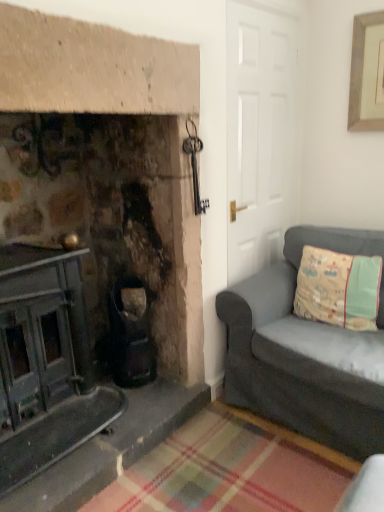
The width and height of the screenshot is (384, 512). Find the location of `dark gray fabric couch at right`. dark gray fabric couch at right is located at coordinates (305, 351).

Describe the element at coordinates (305, 351) in the screenshot. This screenshot has height=512, width=384. I see `dark gray fabric couch at right` at that location.

You are a GUI agent. You are given a task and a screenshot of the screen. Output one action in this format:
    pyautogui.click(x=<x>, y=<y>)
    Task: Click on the beige fabric pillow at right
    
    Given the screenshot: What is the action you would take?
    pyautogui.click(x=338, y=288)

Measure the distance between beige fabric pillow at right and camera.

The depth of beige fabric pillow at right is 2.03 meters.

The image size is (384, 512). Describe the element at coordinates (338, 288) in the screenshot. I see `beige fabric pillow at right` at that location.

Locate an element on the screen. dark gray fabric couch at right is located at coordinates (305, 351).

Is beige fabric pillow at right at the left side of dark gray fabric couch at right?

No, beige fabric pillow at right is not to the left of dark gray fabric couch at right.

From the picture: Does beige fabric pillow at right come in front of dark gray fabric couch at right?

No, it is behind dark gray fabric couch at right.

Considering the positions of points (327, 297) and (290, 232), is point (327, 297) farther from camera compared to point (290, 232)?

That is False.

From the image's perspective, does beige fabric pillow at right appear higher than dark gray fabric couch at right?

Yes, from the image's perspective, beige fabric pillow at right is on top of dark gray fabric couch at right.

From a real-world perspective, which object stands above the other?

beige fabric pillow at right is physically above.

Between beige fabric pillow at right and dark gray fabric couch at right, which one has larger width?

Wider between the two is dark gray fabric couch at right.

Based on the photo, can you confirm if beige fabric pillow at right is shorter than dark gray fabric couch at right?

Yes, beige fabric pillow at right is shorter than dark gray fabric couch at right.

Based on their sizes in the image, would you say beige fabric pillow at right is bigger or smaller than dark gray fabric couch at right?

In the image, beige fabric pillow at right appears to be smaller than dark gray fabric couch at right.

Is beige fabric pillow at right not within dark gray fabric couch at right?

No.

Is beige fabric pillow at right directly adjacent to dark gray fabric couch at right?

No, beige fabric pillow at right is not next to dark gray fabric couch at right.

Is beige fabric pillow at right facing away from dark gray fabric couch at right?

Yes.

Image resolution: width=384 pixels, height=512 pixels. In order to click on studio couch that is under the beige fabric pillow at right (from a real-world perspective) in this screenshot , I will do click(305, 351).

Which object is positioned more to the left, dark gray fabric couch at right or beige fabric pillow at right?

Positioned to the left is dark gray fabric couch at right.

Consider the image. In the image, is dark gray fabric couch at right positioned in front of or behind beige fabric pillow at right?

Clearly, dark gray fabric couch at right is in front of beige fabric pillow at right.

Considering the positions of points (350, 447) and (321, 316), is point (350, 447) farther from camera compared to point (321, 316)?

No.

From the image's perspective, relative to beige fabric pillow at right, is dark gray fabric couch at right above or below?

dark gray fabric couch at right is situated lower than beige fabric pillow at right in the image.

Based on the photo, from a real-world perspective, between dark gray fabric couch at right and beige fabric pillow at right, who is vertically lower?

From a 3D spatial view, dark gray fabric couch at right is below.

Is dark gray fabric couch at right wider or thinner than beige fabric pillow at right?

dark gray fabric couch at right is wider than beige fabric pillow at right.

Considering the sizes of objects dark gray fabric couch at right and beige fabric pillow at right in the image provided, who is shorter, dark gray fabric couch at right or beige fabric pillow at right?

beige fabric pillow at right.

Considering the relative sizes of dark gray fabric couch at right and beige fabric pillow at right in the image provided, is dark gray fabric couch at right smaller than beige fabric pillow at right?

Actually, dark gray fabric couch at right might be larger than beige fabric pillow at right.

Is dark gray fabric couch at right not inside beige fabric pillow at right?

dark gray fabric couch at right lies outside beige fabric pillow at right's area.

Does dark gray fabric couch at right touch beige fabric pillow at right?

dark gray fabric couch at right and beige fabric pillow at right are clearly separated.

Is dark gray fabric couch at right facing away from beige fabric pillow at right?

Yes, beige fabric pillow at right is at the back of dark gray fabric couch at right.

Locate an element on the screen. This screenshot has height=512, width=384. studio couch below the beige fabric pillow at right (from a real-world perspective) is located at coordinates (305, 351).

The height and width of the screenshot is (512, 384). Identify the location of pillow located behind the dark gray fabric couch at right. (338, 288).

Where is `studio couch in front of the beige fabric pillow at right`? studio couch in front of the beige fabric pillow at right is located at coordinates (305, 351).